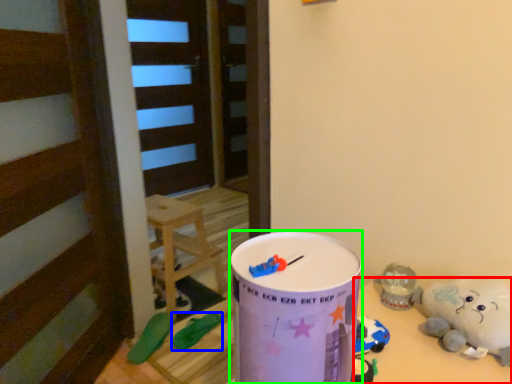
Question: Estimate the real-world distances between objects in this image. Which object is closer to table (highlighted by a red box), toy (highlighted by a blue box) or milk can (highlighted by a green box)?

Choices:
 (A) toy
 (B) milk can

Answer: (B)